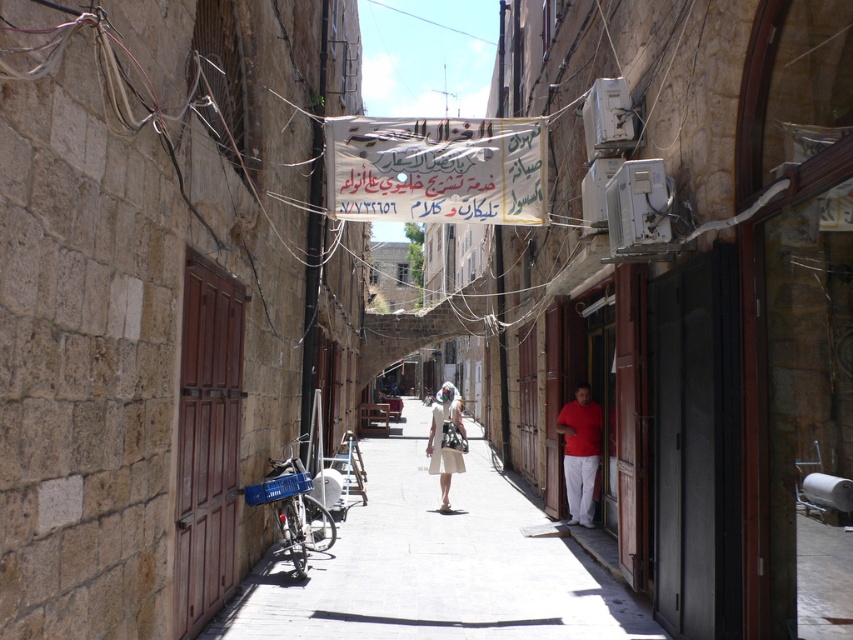
In the scene shown: Who is positioned more to the right, smooth stone pavement at center or white cotton dress at center?

Positioned to the right is white cotton dress at center.

Who is higher up, smooth stone pavement at center or white cotton dress at center?

white cotton dress at center

Which is in front, point (592, 596) or point (454, 404)?

Point (592, 596)

This screenshot has height=640, width=853. What are the coordinates of `smooth stone pavement at center` in the screenshot? It's located at (436, 564).

Does white cotton dress at center appear on the right side of beige fabric dress at center?

Correct, you'll find white cotton dress at center to the right of beige fabric dress at center.

Between white cotton dress at center and beige fabric dress at center, which one has less height?

beige fabric dress at center

Who is more distant from viewer, (440, 387) or (444, 456)?

Positioned behind is point (440, 387).

This screenshot has height=640, width=853. Identify the location of white cotton dress at center. (445, 440).

Does matte red shirt at right have a smaller size compared to beige fabric dress at center?

Indeed, matte red shirt at right has a smaller size compared to beige fabric dress at center.

Can you confirm if matte red shirt at right is positioned to the right of beige fabric dress at center?

Yes, matte red shirt at right is to the right of beige fabric dress at center.

Locate an element on the screen. This screenshot has height=640, width=853. matte red shirt at right is located at coordinates (579, 452).